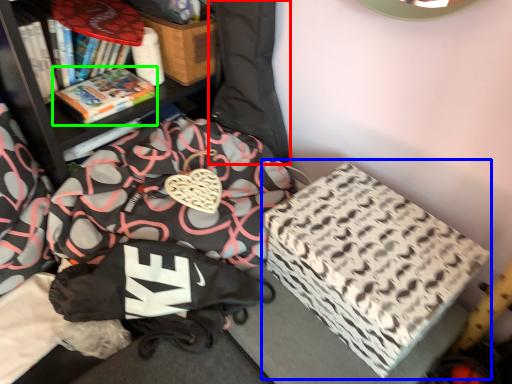
Question: Based on their relative distances, which object is farther from bean bag chair (highlighted by a red box)? Choose from cardboard box (highlighted by a blue box) and book (highlighted by a green box).

Choices:
 (A) cardboard box
 (B) book

Answer: (A)